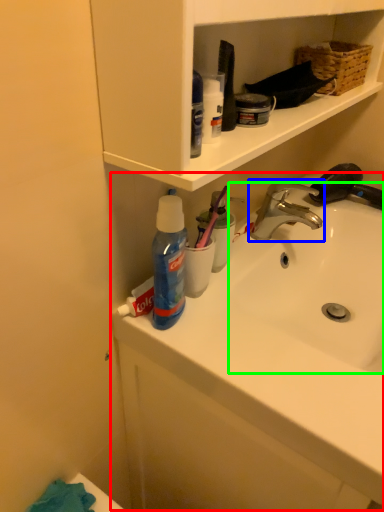
Question: Which object is the farthest from sink (highlighted by a red box)? Choose among these: tap (highlighted by a blue box) or sink (highlighted by a green box).

Choices:
 (A) tap
 (B) sink

Answer: (A)